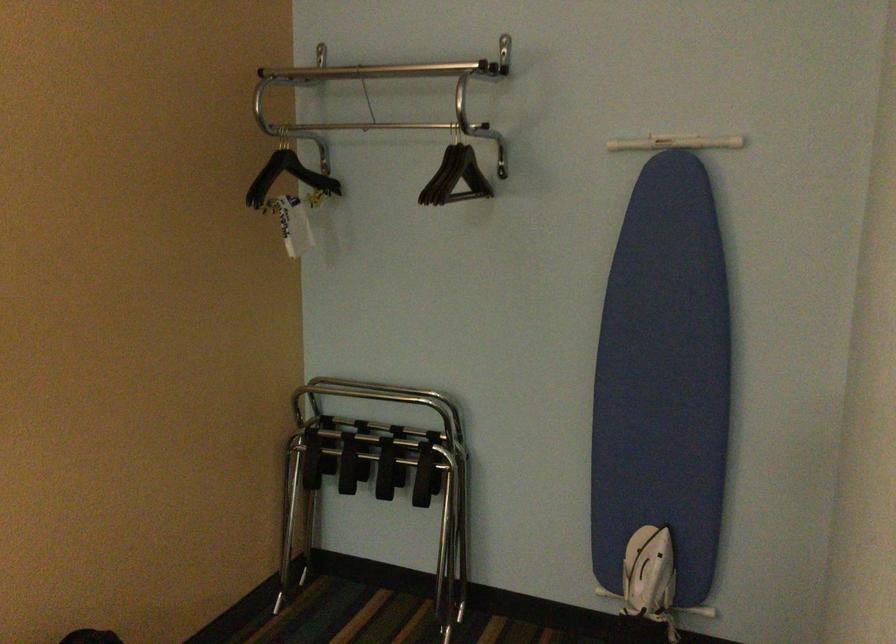
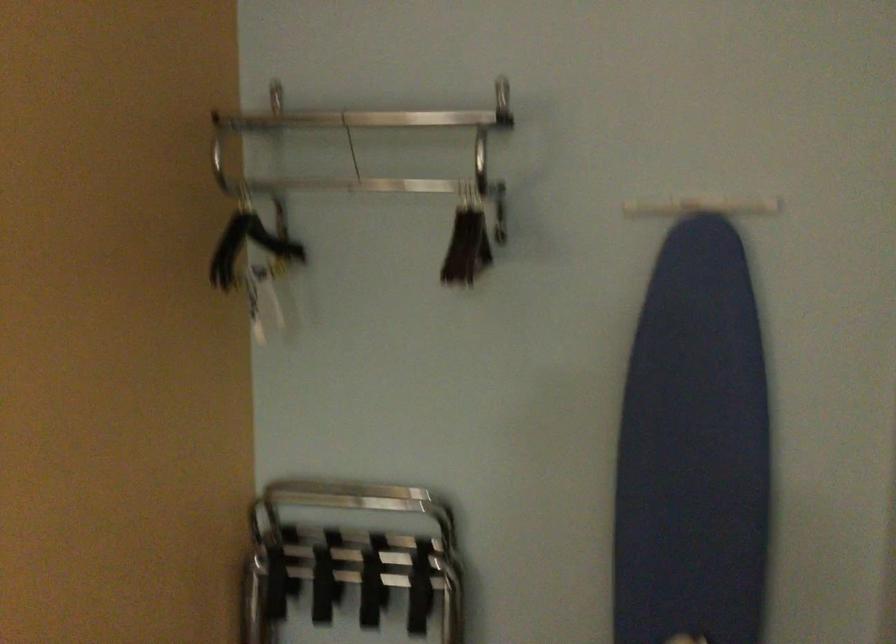
Locate, in the second image, the point that corresponds to pixel 449 176 in the first image.

(467, 245)